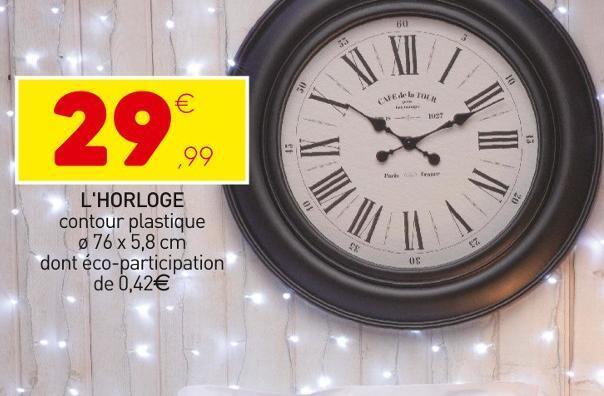
This screenshot has width=604, height=396. I want to click on hour clock hand, so click(x=377, y=122).